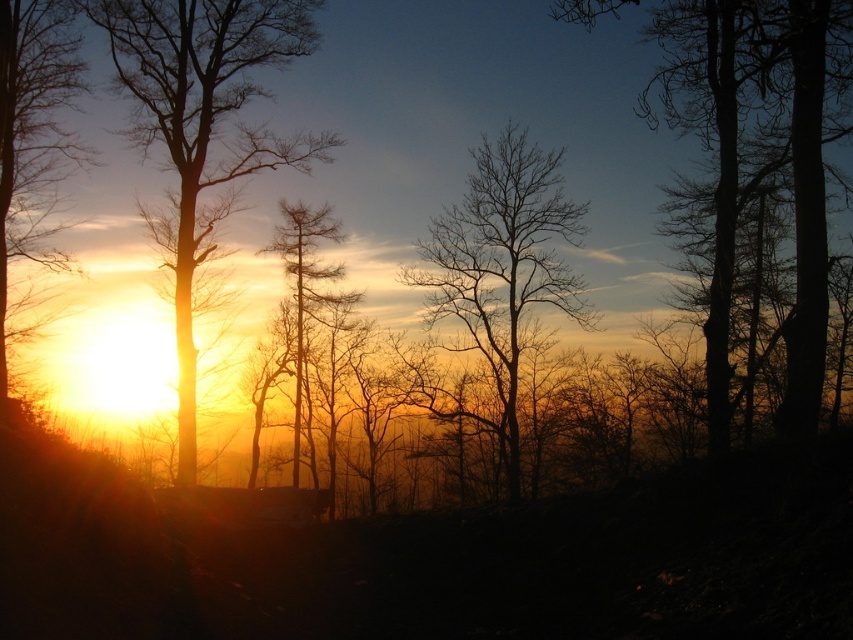
Question: Which object appears farthest from the camera in this image?

Choices:
 (A) silvery textured pine tree at center
 (B) silhouette bark tree at right
 (C) matte orange sun at left
 (D) bare branches at center

Answer: (A)

Question: Estimate the real-world distances between objects in this image. Which object is closer to the matte orange sun at left?

Choices:
 (A) silhouette bare tree at left
 (B) silhouette bark tree at right
 (C) bare branches at center
 (D) silvery textured pine tree at center

Answer: (A)

Question: Can you confirm if bare branches at center is positioned below matte orange sun at left?

Choices:
 (A) no
 (B) yes

Answer: (B)

Question: Is bare branches at center closer to the viewer compared to matte orange sun at left?

Choices:
 (A) yes
 (B) no

Answer: (B)

Question: Which object is positioned closest to the silhouette bark tree at right?

Choices:
 (A) silhouette bare tree at left
 (B) silvery textured pine tree at center

Answer: (A)

Question: Does silhouette bark tree at right have a smaller size compared to silvery textured pine tree at center?

Choices:
 (A) no
 (B) yes

Answer: (A)